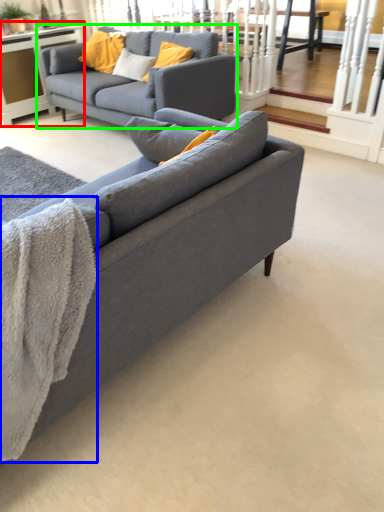
Question: Which object is positioned farthest from table (highlighted by a red box)? Select from blanket (highlighted by a blue box) and studio couch (highlighted by a green box).

Choices:
 (A) blanket
 (B) studio couch

Answer: (A)